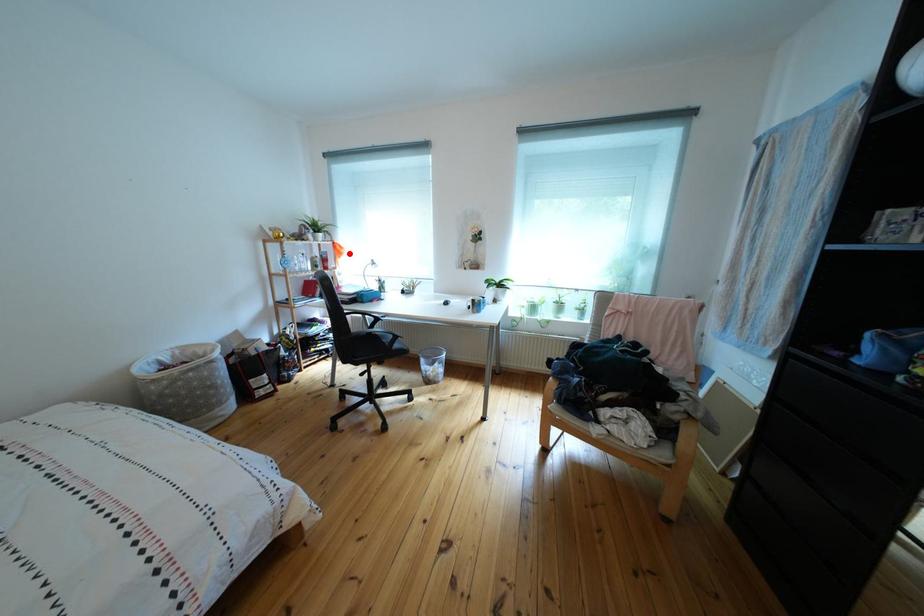
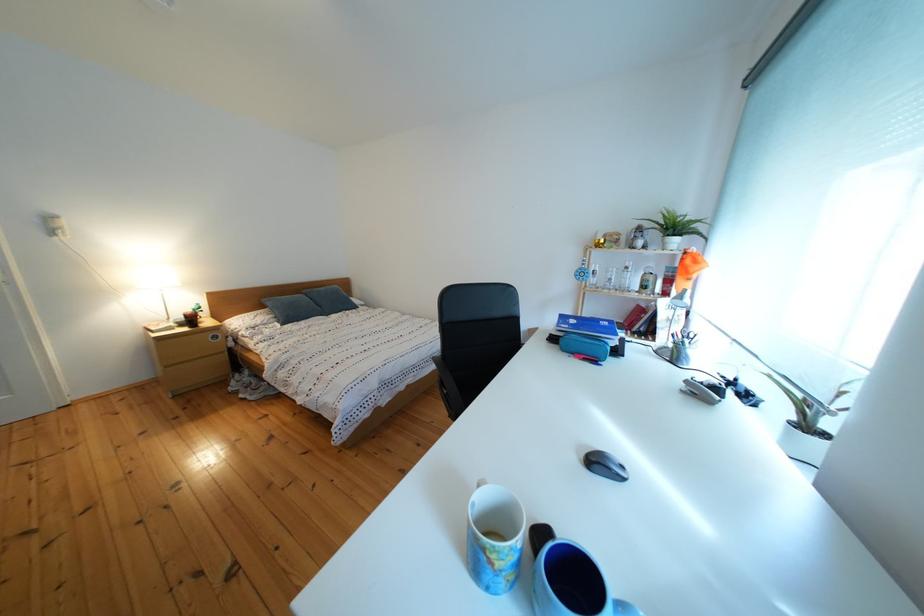
Locate, in the second image, the point that corresponds to the highlighted location in the first image.

(699, 267)